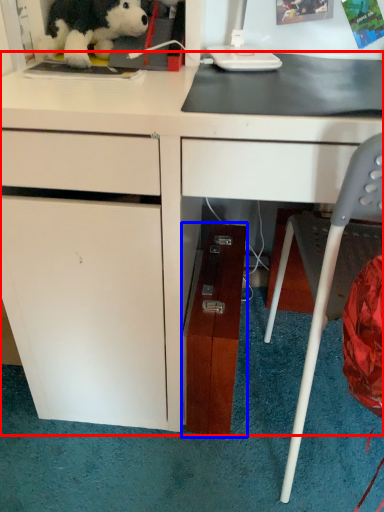
Question: Which point is closer to the camera, desk (highlighted by a red box) or file cabinet (highlighted by a blue box)?

Choices:
 (A) desk
 (B) file cabinet

Answer: (A)